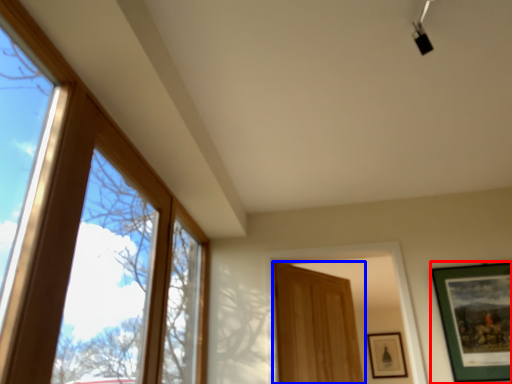
Question: Which of the following is the farthest to the observer, picture frame (highlighted by a red box) or door (highlighted by a blue box)?

Choices:
 (A) picture frame
 (B) door

Answer: (B)